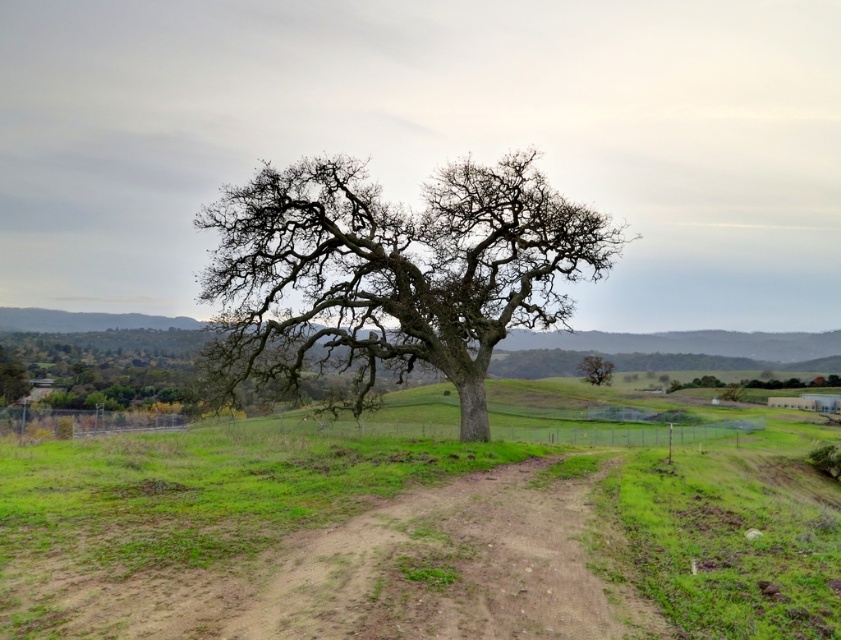
Question: Does brown dirt track at center come behind smooth brown tree at center?

Choices:
 (A) no
 (B) yes

Answer: (A)

Question: Among these points, which one is nearest to the camera?

Choices:
 (A) (438, 272)
 (B) (96, 621)
 (C) (609, 374)

Answer: (B)

Question: Does smooth bark oak at center have a smaller size compared to smooth brown tree at center?

Choices:
 (A) no
 (B) yes

Answer: (A)

Question: Is smooth bark oak at center closer to camera compared to smooth brown tree at center?

Choices:
 (A) yes
 (B) no

Answer: (A)

Question: Which point is closer to the camera taking this photo?

Choices:
 (A) (x=598, y=358)
 (B) (x=226, y=259)
 (C) (x=175, y=532)

Answer: (C)

Question: Which of these objects is positioned farthest from the brown dirt track at center?

Choices:
 (A) smooth brown tree at center
 (B) smooth bark oak at center

Answer: (A)